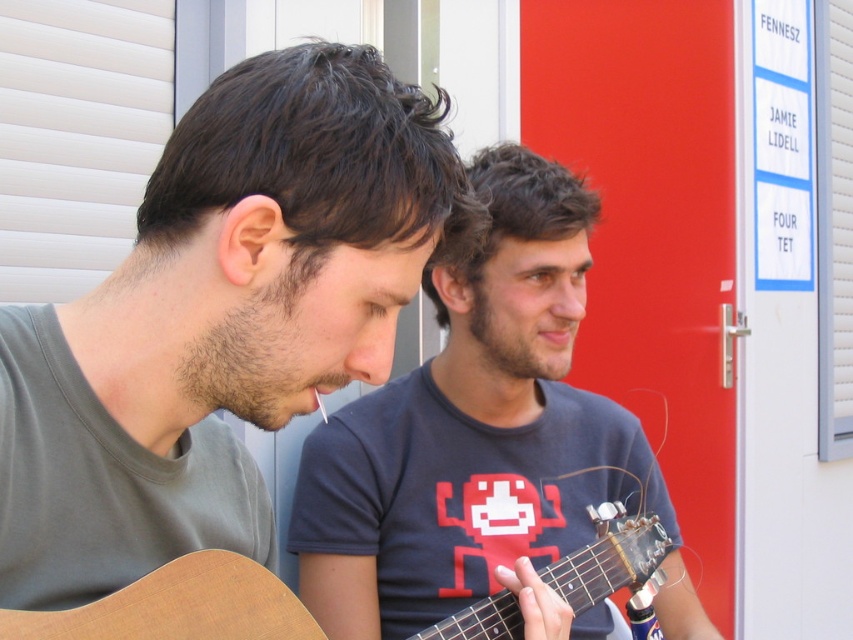
Which is behind, point (13, 499) or point (515, 481)?

Point (515, 481)

Between point (78, 480) and point (395, 605), which one is positioned behind?

Point (395, 605)

Identify the location of matte brown guitar at left. This screenshot has height=640, width=853. (219, 320).

Find the location of a particular element. dark blue t-shirt at center is located at coordinates coord(479,435).

This screenshot has height=640, width=853. What do you see at coordinates (479, 435) in the screenshot?
I see `dark blue t-shirt at center` at bounding box center [479, 435].

You are a GUI agent. You are given a task and a screenshot of the screen. Output one action in this format:
    pyautogui.click(x=<x>, y=<y>)
    Task: Click on the dark blue t-shirt at center
    This screenshot has width=853, height=640.
    Given the screenshot: What is the action you would take?
    pyautogui.click(x=479, y=435)

Does matte brown guitar at left appear under wooden acoustic guitar at center?

Incorrect, matte brown guitar at left is not positioned below wooden acoustic guitar at center.

Is point (160, 221) less distant than point (460, 618)?

Yes, it is.

Is point (241, 166) more distant than point (636, 536)?

No.

Image resolution: width=853 pixels, height=640 pixels. I want to click on matte brown guitar at left, so click(x=219, y=320).